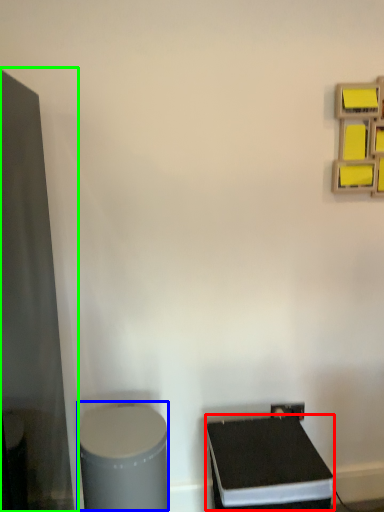
Question: Which object is the closest to the wide (highlighted by a red box)? Choose among these: wide (highlighted by a blue box) or glass door (highlighted by a green box).

Choices:
 (A) wide
 (B) glass door

Answer: (A)